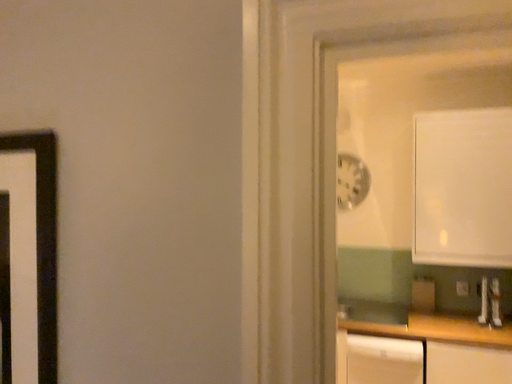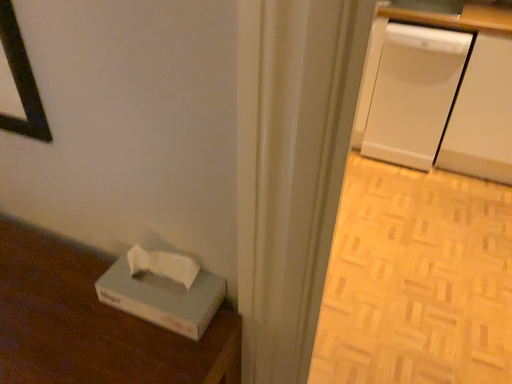
Question: Which way did the camera rotate in the video?

Choices:
 (A) rotated downward
 (B) rotated upward

Answer: (A)